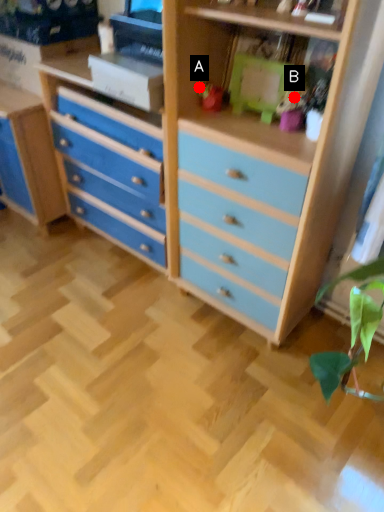
Question: Two points are circled on the image, labeled by A and B beside each circle. Which point is closer to the camera taking this photo?

Choices:
 (A) A is closer
 (B) B is closer

Answer: (B)